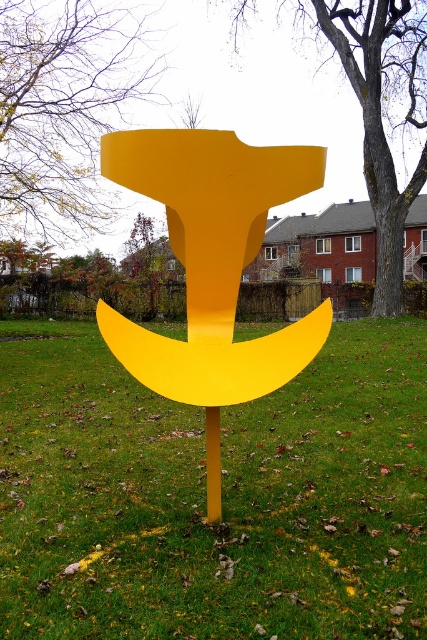
You are standing in a park and see the matte yellow anchor at center and the smooth bark tree at upper left. Which object would appear larger to you?

The matte yellow anchor at center appears larger because it is closer to the viewer than the smooth bark tree at upper left.

What are the coordinates of the matte yellow anchor at center?

The matte yellow anchor at center is located at coordinates point (211,259).

You are a gardener planning to mow the lawn. You see the green grass at center and the smooth bark tree at center. Which one can be trimmed with a regular lawnmower?

The green grass at center can be trimmed with a regular lawnmower since it is shorter than the smooth bark tree at center.